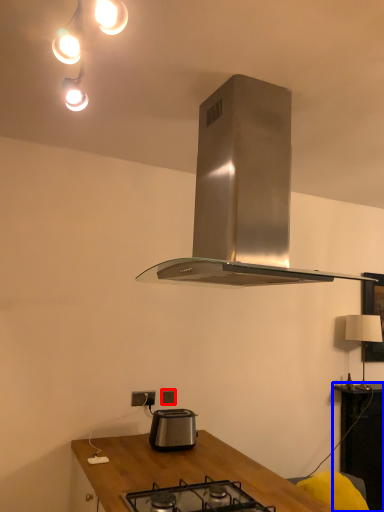
Question: Which object appears closest to the camera in this image, power plugs and sockets (highlighted by a red box) or table (highlighted by a blue box)?

Choices:
 (A) power plugs and sockets
 (B) table

Answer: (A)